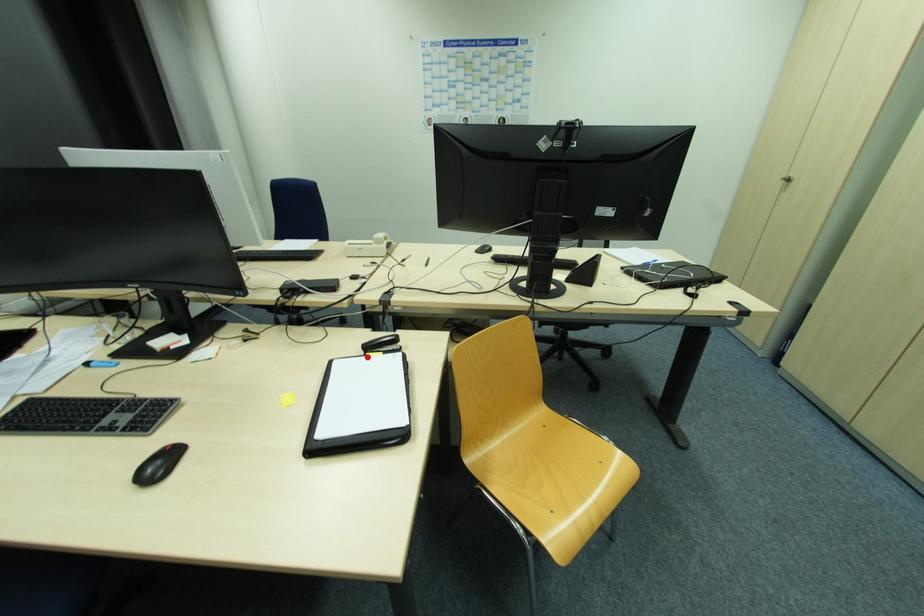
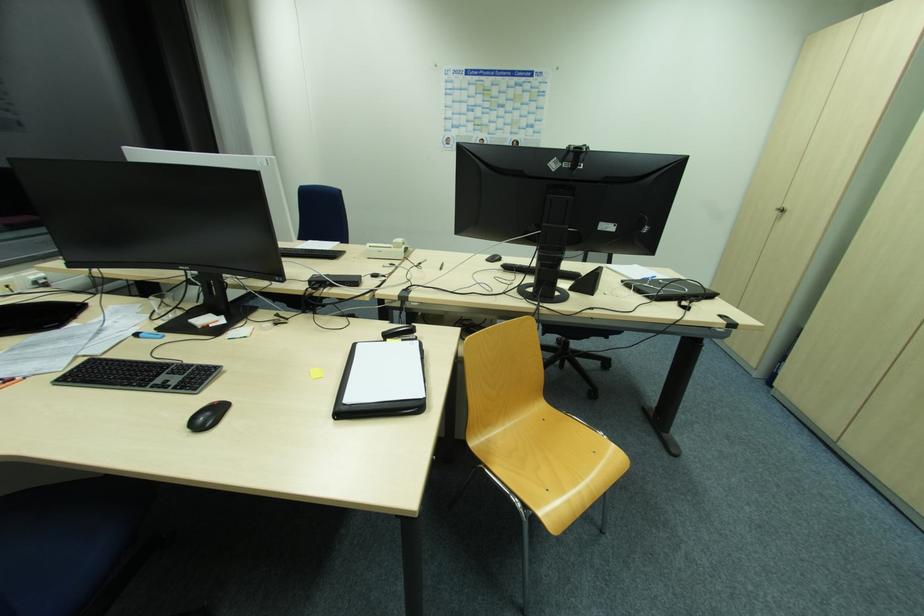
The point at the highlighted location is marked in the first image. Where is the corresponding point in the second image?

(387, 342)